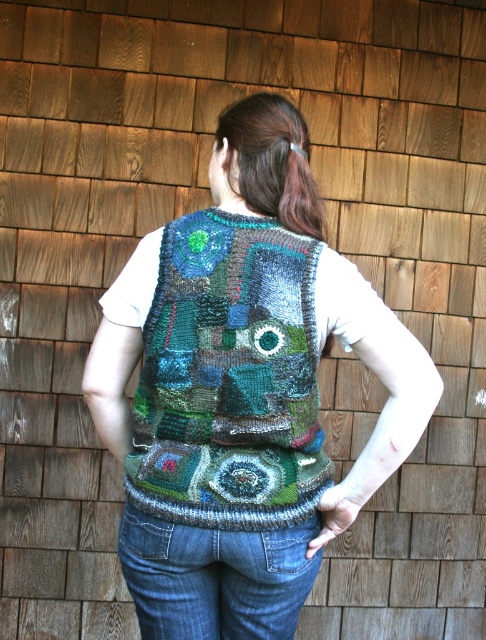
Question: Does knitted vest at center appear under knitted multicolored vest at center?

Choices:
 (A) yes
 (B) no

Answer: (A)

Question: Which point is closer to the camera?

Choices:
 (A) denim at lower center
 (B) knitted vest at center
 (C) knitted multicolored vest at center

Answer: (B)

Question: Does knitted vest at center appear on the left side of knitted multicolored vest at center?

Choices:
 (A) yes
 (B) no

Answer: (B)

Question: Which object is positioned farthest from the knitted multicolored vest at center?

Choices:
 (A) denim at lower center
 (B) knitted vest at center

Answer: (A)

Question: Which point is farther from the camera taking this photo?

Choices:
 (A) (211, 580)
 (B) (214, 440)
 (C) (208, 291)

Answer: (A)

Question: Does knitted multicolored vest at center have a smaller size compared to denim at lower center?

Choices:
 (A) yes
 (B) no

Answer: (B)